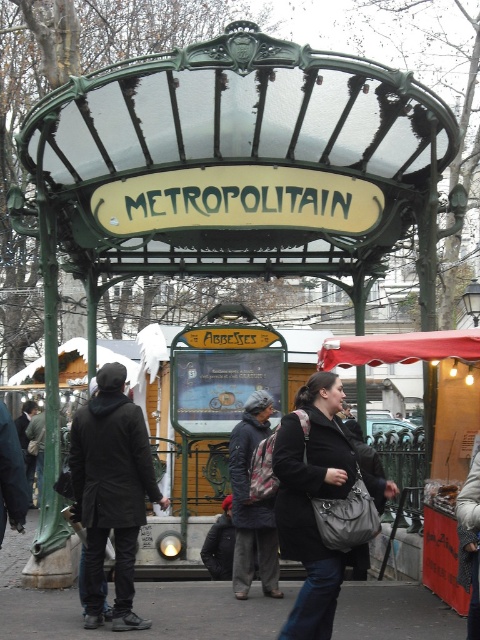
Question: Which point is closer to the camera taking this photo?

Choices:
 (A) (324, 416)
 (B) (322, 348)

Answer: (A)

Question: Does matte black coat at center appear under red fabric canopy at center?

Choices:
 (A) no
 (B) yes

Answer: (B)

Question: Is matte black coat at center below red fabric canopy at center?

Choices:
 (A) yes
 (B) no

Answer: (A)

Question: Is matte black coat at center in front of red fabric canopy at center?

Choices:
 (A) yes
 (B) no

Answer: (A)

Question: Which point is farther from the camera taking this photo?

Choices:
 (A) (471, 330)
 (B) (331, 428)

Answer: (A)